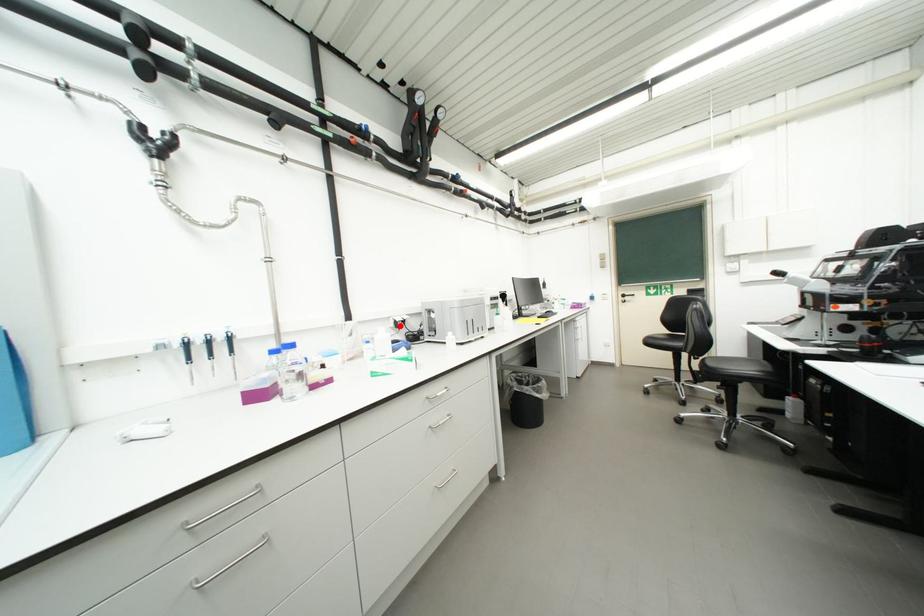
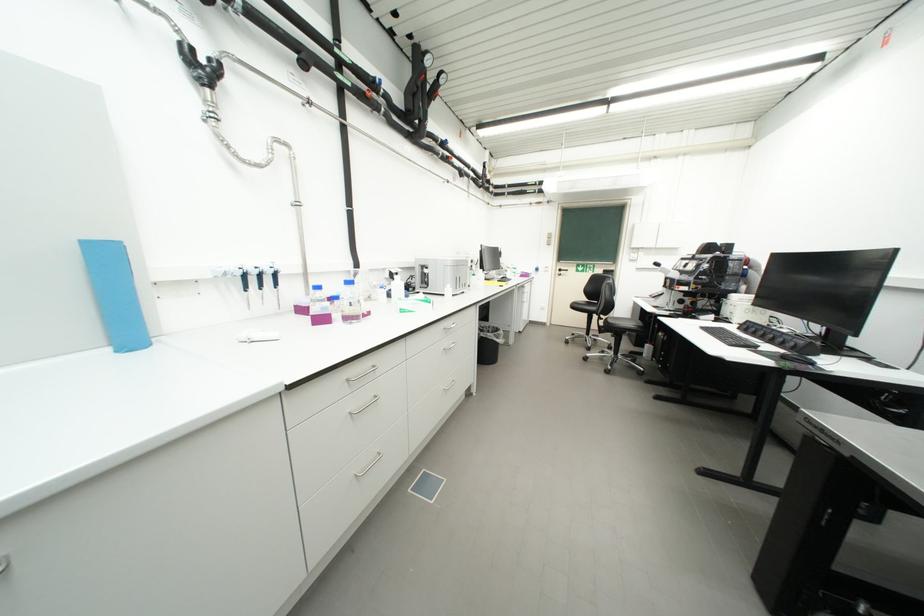
In the second image, find the point that corresponds to the highlighted location in the first image.

(395, 277)